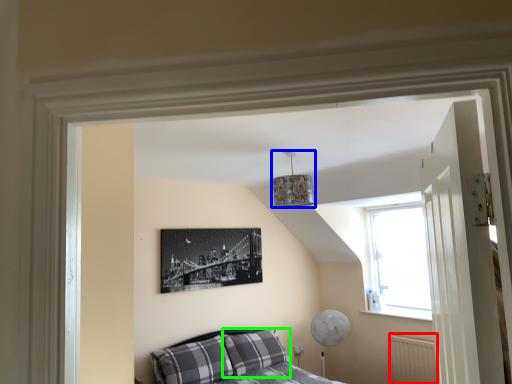
Question: Which object is positioned closest to radiator (highlighted by a red box)? Select from lamp (highlighted by a blue box) and pillow (highlighted by a green box).

Choices:
 (A) lamp
 (B) pillow

Answer: (B)